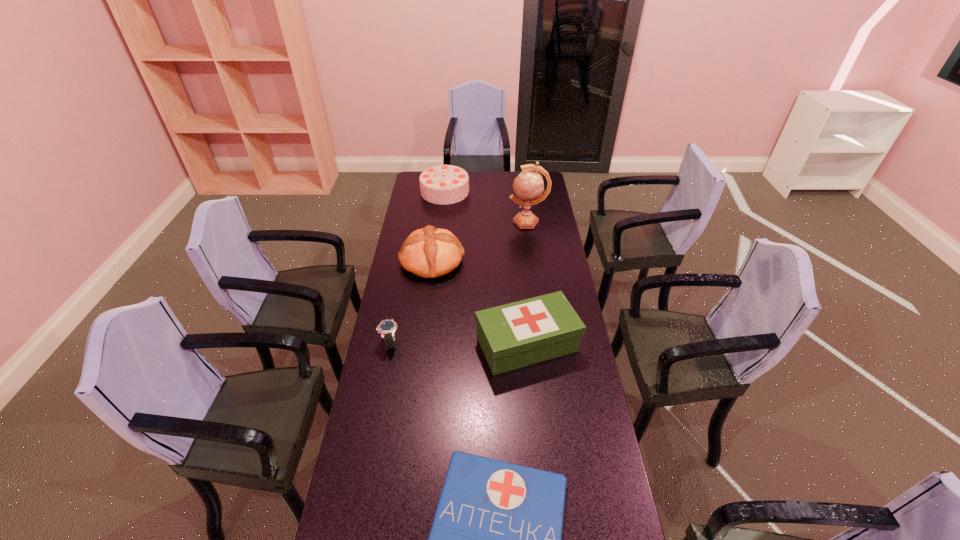
Find the location of `object located in the far left corner section of the desktop`. object located in the far left corner section of the desktop is located at coordinates (444, 184).

In the image, there is a desktop. At what (x,y) coordinates should I click in order to perform the action: click on free region at the far edge. Please return your answer as a coordinate pair (x, y). Image resolution: width=960 pixels, height=540 pixels. Looking at the image, I should click on point(508,174).

Identify the location of vacant space at the left edge. This screenshot has width=960, height=540. (383, 391).

This screenshot has height=540, width=960. In the image, there is a desktop. Identify the location of free space at the right edge. (546, 272).

Find the location of a particular element. This screenshot has height=540, width=960. free space that is in between the globe and the taller first-aid kit is located at coordinates (527, 283).

Find the location of a particular element. vacant area that lies between the farthest object and the farther first-aid kit is located at coordinates (486, 268).

Where is `free space between the fifth nearest object and the farther first-aid kit`? The image size is (960, 540). free space between the fifth nearest object and the farther first-aid kit is located at coordinates (527, 283).

The width and height of the screenshot is (960, 540). Identify the location of free space that is in between the farthest object and the second farthest object. (486, 206).

Image resolution: width=960 pixels, height=540 pixels. Identify the location of vacant space that is in between the second farthest object and the fourth nearest object. click(480, 241).

Where is `object that ranks as the fourth closest to the fifth tallest object`? The width and height of the screenshot is (960, 540). object that ranks as the fourth closest to the fifth tallest object is located at coordinates (528, 185).